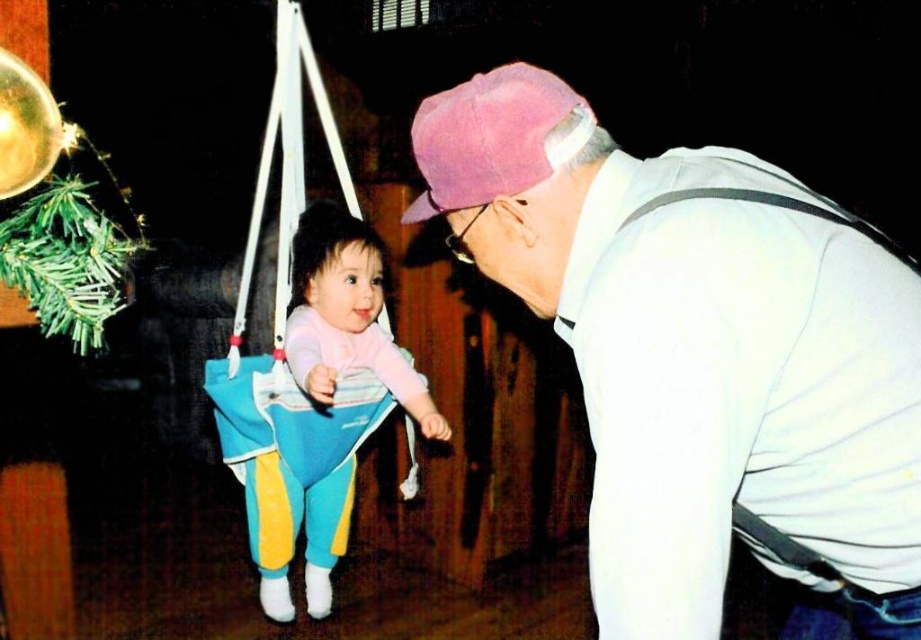
Question: Does pastel pink fabric baby swing at center have a larger size compared to pink fabric baseball cap at upper center?

Choices:
 (A) yes
 (B) no

Answer: (A)

Question: Considering the real-world distances, which object is farthest from the white cotton shirt at upper right?

Choices:
 (A) pink fabric baseball cap at upper center
 (B) pastel pink fabric baby swing at center

Answer: (B)

Question: Can you confirm if white cotton shirt at upper right is positioned to the right of pastel pink fabric baby swing at center?

Choices:
 (A) yes
 (B) no

Answer: (A)

Question: Considering the real-world distances, which object is closest to the pastel pink fabric baby swing at center?

Choices:
 (A) white cotton shirt at upper right
 (B) pink fabric baseball cap at upper center

Answer: (B)

Question: Which of the following is the closest to the observer?

Choices:
 (A) (325, 547)
 (B) (450, 138)
 (C) (519, 77)

Answer: (C)

Question: Can you confirm if white cotton shirt at upper right is bigger than pink fabric baseball cap at upper center?

Choices:
 (A) no
 (B) yes

Answer: (B)